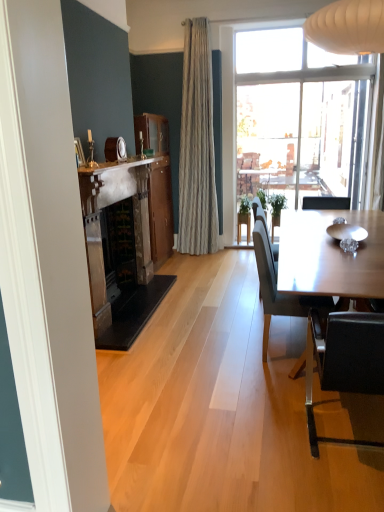
Question: Can you confirm if dark gray fabric chair at right, positioned as the 1th chair in back-to-front order, is shorter than mahogany wood cabinet at center?

Choices:
 (A) no
 (B) yes

Answer: (B)

Question: From a real-world perspective, is dark gray fabric chair at right, marked as the 2th chair in a front-to-back arrangement, over mahogany wood cabinet at center?

Choices:
 (A) no
 (B) yes

Answer: (A)

Question: Is dark gray fabric chair at right, positioned as the 1th chair in back-to-front order, at the right side of mahogany wood cabinet at center?

Choices:
 (A) no
 (B) yes

Answer: (B)

Question: Can you confirm if dark gray fabric chair at right, positioned as the 1th chair in back-to-front order, is smaller than mahogany wood cabinet at center?

Choices:
 (A) no
 (B) yes

Answer: (B)

Question: Is dark gray fabric chair at right, marked as the 2th chair in a front-to-back arrangement, oriented towards mahogany wood cabinet at center?

Choices:
 (A) no
 (B) yes

Answer: (A)

Question: From the image's perspective, is dark gray fabric chair at right, positioned as the 1th chair in back-to-front order, located beneath mahogany wood cabinet at center?

Choices:
 (A) no
 (B) yes

Answer: (B)

Question: Would you say white marble fireplace at upper center is outside dark gray fabric chair at right, positioned as the 1th chair in back-to-front order?

Choices:
 (A) yes
 (B) no

Answer: (A)

Question: Is white marble fireplace at upper center positioned in front of dark gray fabric chair at right, positioned as the 1th chair in back-to-front order?

Choices:
 (A) no
 (B) yes

Answer: (A)

Question: Does white marble fireplace at upper center have a greater width compared to dark gray fabric chair at right, marked as the 2th chair in a front-to-back arrangement?

Choices:
 (A) yes
 (B) no

Answer: (B)

Question: From the image's perspective, is white marble fireplace at upper center on dark gray fabric chair at right, marked as the 2th chair in a front-to-back arrangement?

Choices:
 (A) no
 (B) yes

Answer: (B)

Question: Is dark gray fabric chair at right, marked as the 2th chair in a front-to-back arrangement, inside white marble fireplace at upper center?

Choices:
 (A) no
 (B) yes

Answer: (A)

Question: Does white marble fireplace at upper center have a greater height compared to dark gray fabric chair at right, marked as the 2th chair in a front-to-back arrangement?

Choices:
 (A) yes
 (B) no

Answer: (B)

Question: Is white marble fireplace at upper center shorter than wooden picture frame at upper left?

Choices:
 (A) no
 (B) yes

Answer: (B)